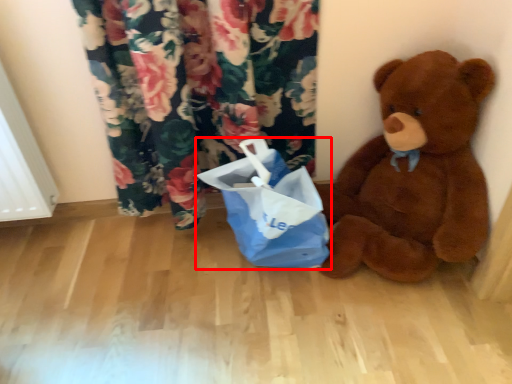
Question: Observing the image, what is the correct spatial positioning of shopping bag (annotated by the red box) in reference to teddy bear?

Choices:
 (A) left
 (B) right

Answer: (A)